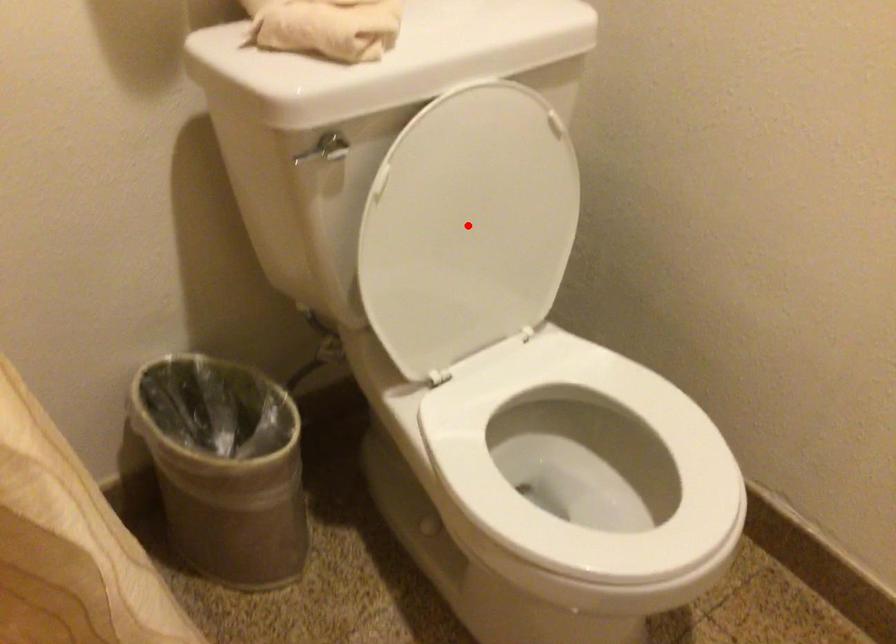
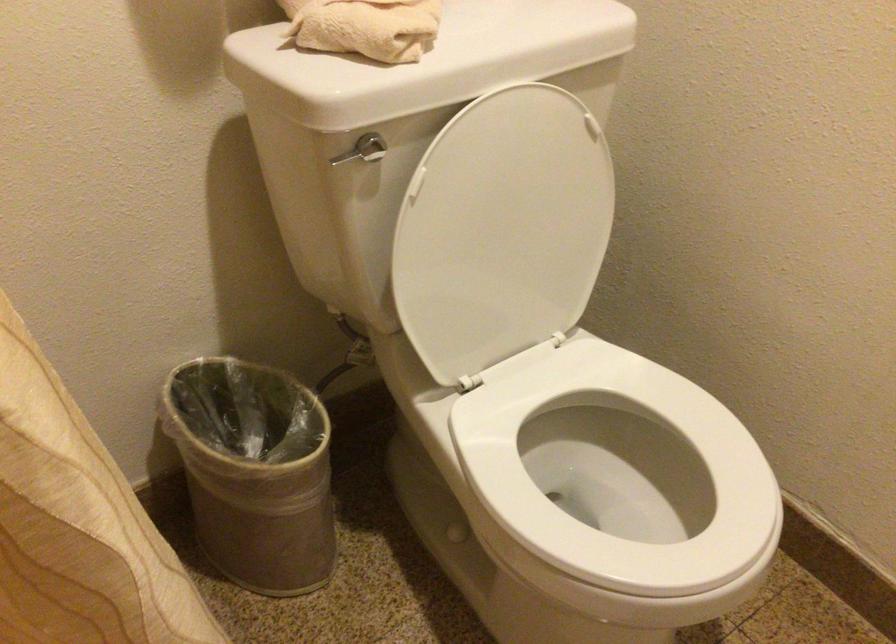
Find the pixel in the second image that matches the highlighted location in the first image.

(502, 230)